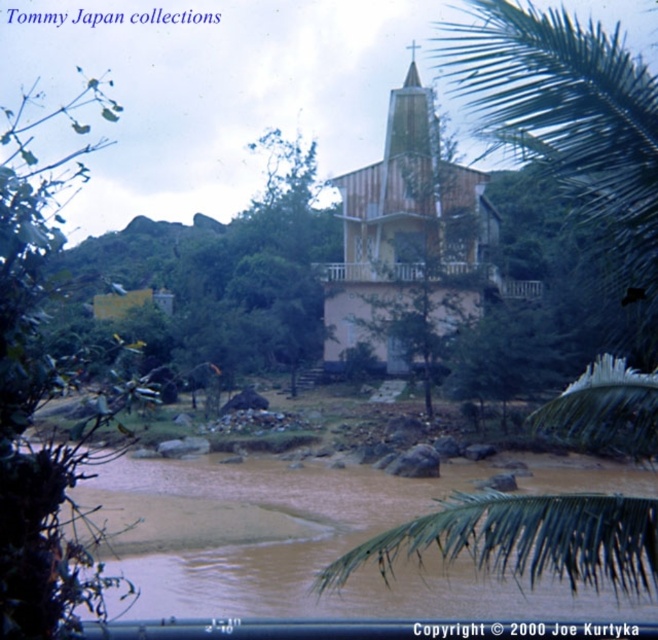
From the picture: Measure the distance between green leafy palm tree at upper right and camera.

A distance of 4.73 meters exists between green leafy palm tree at upper right and camera.

Is green leafy palm tree at upper right taller than green leafy tree at left?

Incorrect, green leafy palm tree at upper right's height is not larger of green leafy tree at left's.

Which is behind, point (582, 52) or point (43, 372)?

The point (582, 52) is behind.

Where is `green leafy palm tree at upper right`? green leafy palm tree at upper right is located at coordinates (569, 113).

Which is more to the right, green leafy palm tree at upper right or brown muddy water at lower center?

From the viewer's perspective, green leafy palm tree at upper right appears more on the right side.

Which is behind, point (484, 22) or point (338, 602)?

Point (484, 22)

Does point (542, 72) lie in front of point (282, 497)?

Yes, it is in front of point (282, 497).

Where is `green leafy palm tree at upper right`? Image resolution: width=658 pixels, height=640 pixels. green leafy palm tree at upper right is located at coordinates (569, 113).

Is green leafy tree at left wider than wooden church at center?

Yes, green leafy tree at left is wider than wooden church at center.

Can you confirm if green leafy tree at left is positioned to the right of wooden church at center?

No, green leafy tree at left is not to the right of wooden church at center.

Which is behind, point (16, 134) or point (338, 324)?

Point (16, 134)

Where is `green leafy tree at left`? green leafy tree at left is located at coordinates (43, 392).